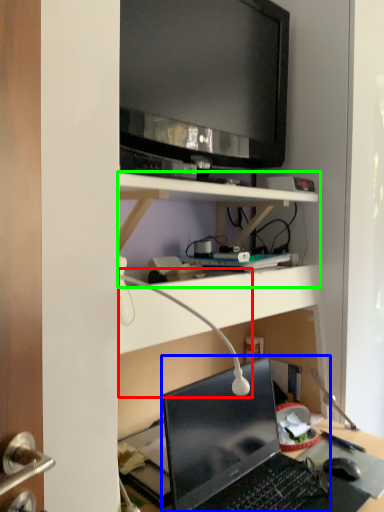
Question: Based on their relative distances, which object is farther from table lamp (highlighted by a red box)? Choose from laptop (highlighted by a blue box) and shelf (highlighted by a green box).

Choices:
 (A) laptop
 (B) shelf

Answer: (B)